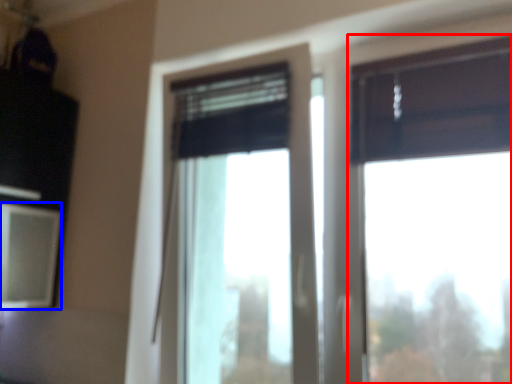
Question: Which point is closer to the camera, window (highlighted by a red box) or window screen (highlighted by a blue box)?

Choices:
 (A) window
 (B) window screen

Answer: (A)